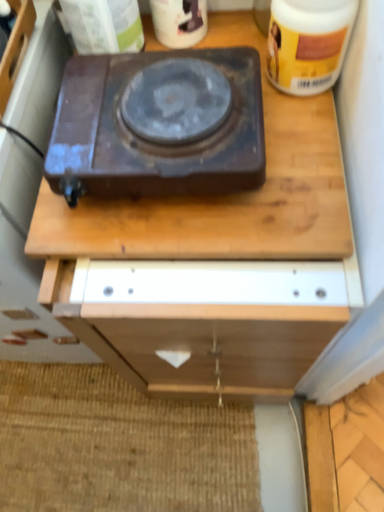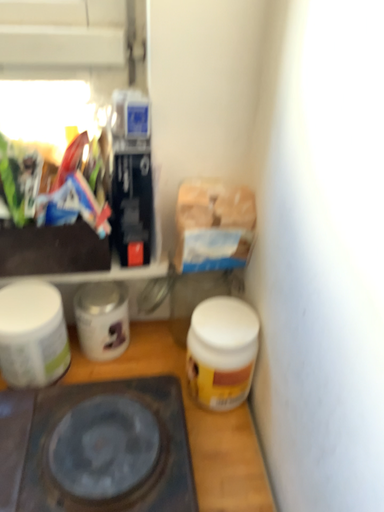
Question: How did the camera likely rotate when shooting the video?

Choices:
 (A) rotated right
 (B) rotated left

Answer: (A)